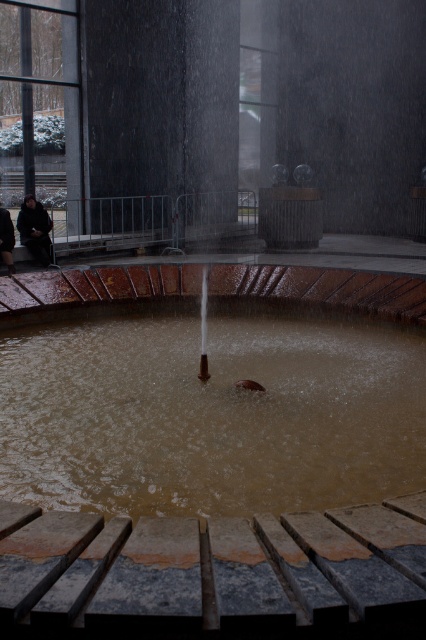
Question: Among these objects, which one is nearest to the camera?

Choices:
 (A) dark brown leather jacket at left
 (B) black polished stone pillar at upper center
 (C) brown matte water at center
 (D) dark gray coat at left

Answer: (C)

Question: Which is farther from the brown matte water at center?

Choices:
 (A) dark gray coat at left
 (B) dark brown leather jacket at left
 (C) black polished stone pillar at upper center

Answer: (C)

Question: Considering the relative positions of black polished stone pillar at upper center and dark gray coat at left in the image provided, where is black polished stone pillar at upper center located with respect to dark gray coat at left?

Choices:
 (A) right
 (B) left

Answer: (A)

Question: Which is nearer to the brown matte water at center?

Choices:
 (A) dark gray coat at left
 (B) dark brown leather jacket at left

Answer: (A)

Question: Does black polished stone pillar at upper center have a larger size compared to dark gray coat at left?

Choices:
 (A) no
 (B) yes

Answer: (A)

Question: Does black polished stone pillar at upper center appear on the right side of dark brown leather jacket at left?

Choices:
 (A) no
 (B) yes

Answer: (B)